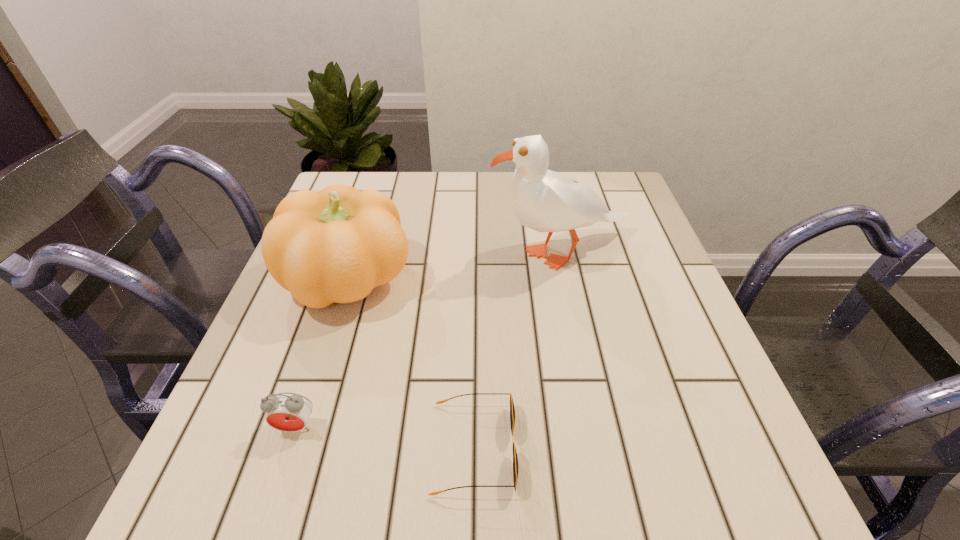
Where is `the second closest object to the sunglasses`? the second closest object to the sunglasses is located at coordinates (289, 412).